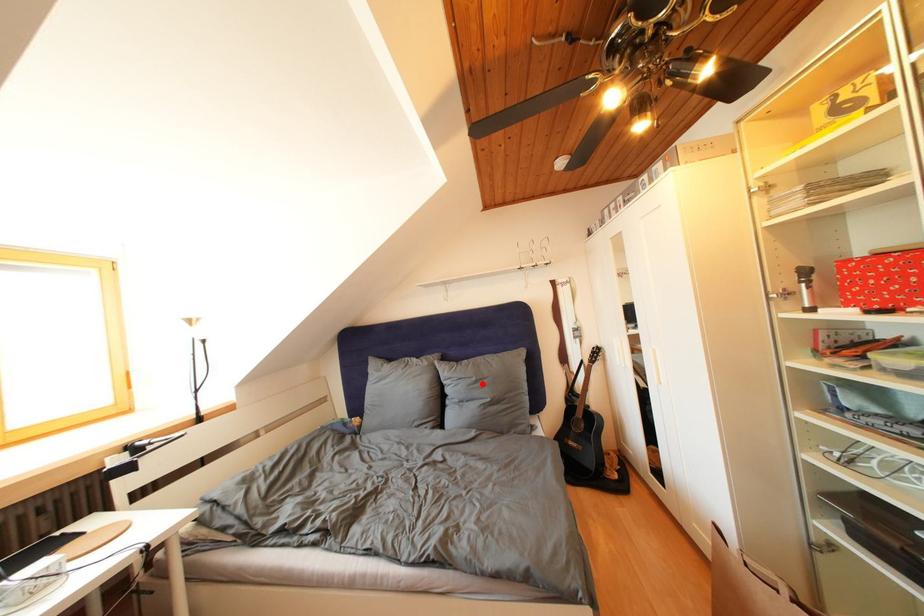
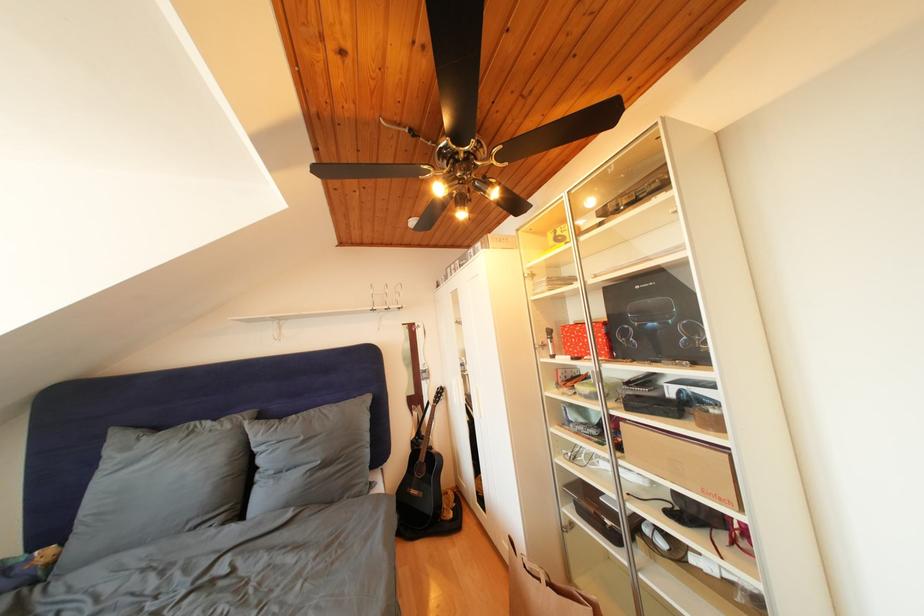
Question: I am providing you with two images of the same scene from different viewpoints. A red point is marked on the first image. Can you still see the location of the red point in image 2?

Choices:
 (A) Yes
 (B) No

Answer: (A)